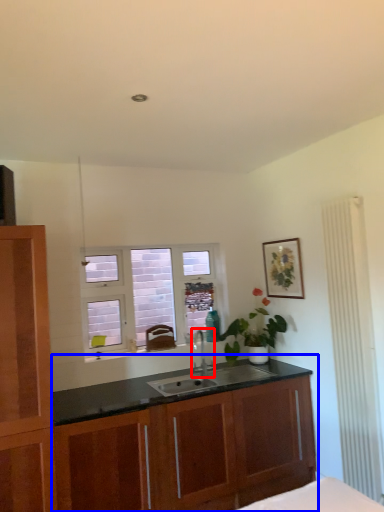
Question: Which object appears closest to the camera in this image, tap (highlighted by a red box) or cabinetry (highlighted by a blue box)?

Choices:
 (A) tap
 (B) cabinetry

Answer: (B)